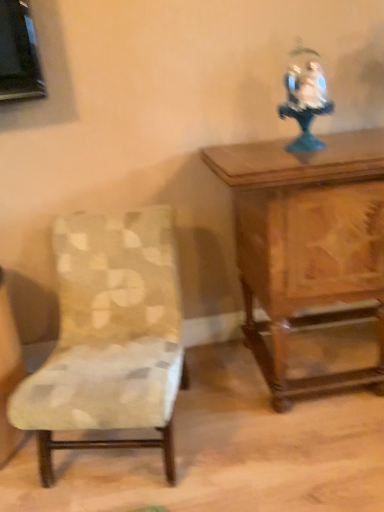
Locate an element on the screen. vacant space to the right of patterned fabric chair at left is located at coordinates (242, 438).